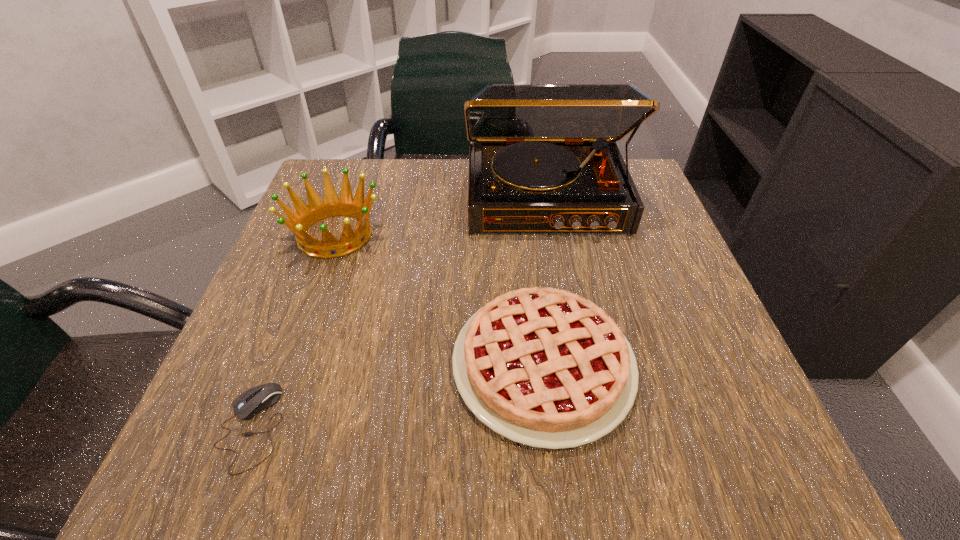
Identify the location of free space between the second shortest object and the computer mouse. The height and width of the screenshot is (540, 960). (397, 396).

Locate an element on the screen. vacant area between the pie and the record player is located at coordinates (544, 282).

Locate an element on the screen. Image resolution: width=960 pixels, height=540 pixels. free space between the second tallest object and the tallest object is located at coordinates (441, 217).

This screenshot has height=540, width=960. Identify the location of free space between the crown and the shortest object. (293, 330).

Where is `vacant area between the tallest object and the crown`? vacant area between the tallest object and the crown is located at coordinates (441, 217).

Locate which object is the closest to the second shortest object. Please provide its 2D coordinates. Your answer should be formatted as a tuple, i.e. [(x, y)], where the tuple contains the x and y coordinates of a point satisfying the conditions above.

[(543, 158)]

Point out which object is positioned as the second nearest to the record player. Please provide its 2D coordinates. Your answer should be formatted as a tuple, i.e. [(x, y)], where the tuple contains the x and y coordinates of a point satisfying the conditions above.

[(299, 222)]

I want to click on free space that satisfies the following two spatial constraints: 1. on the back side of the computer mouse; 2. on the right side of the second shortest object, so click(x=276, y=364).